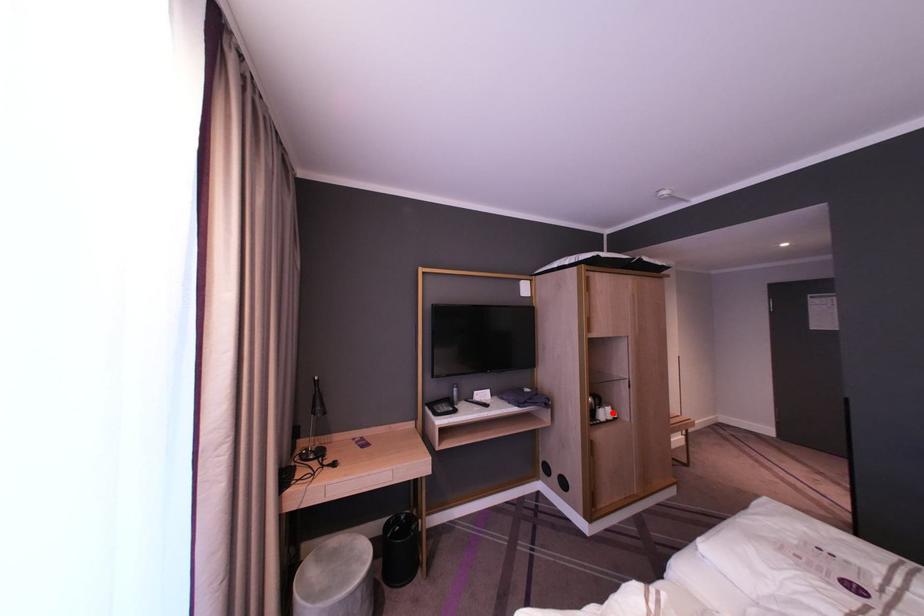
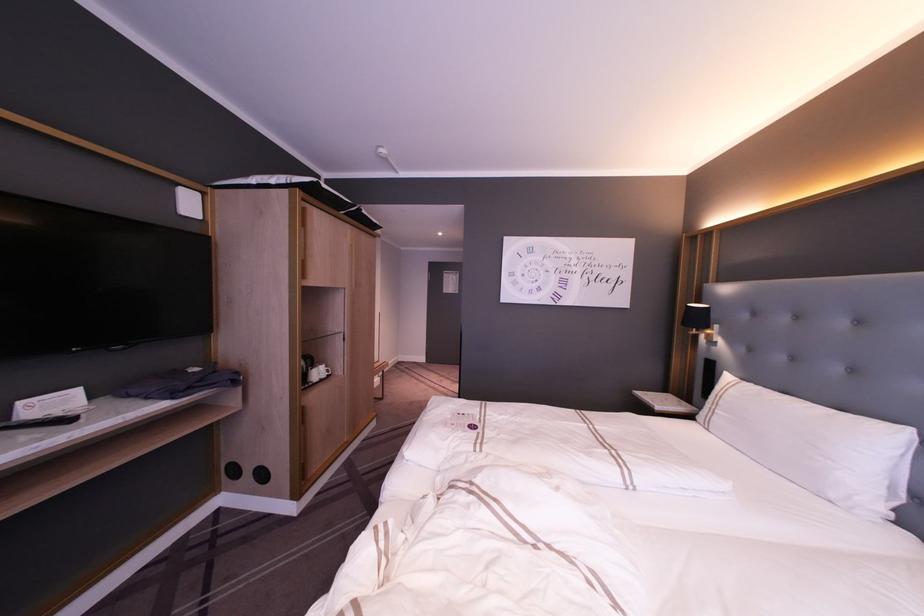
In the second image, find the point that corresponds to the highlighted location in the first image.

(326, 370)